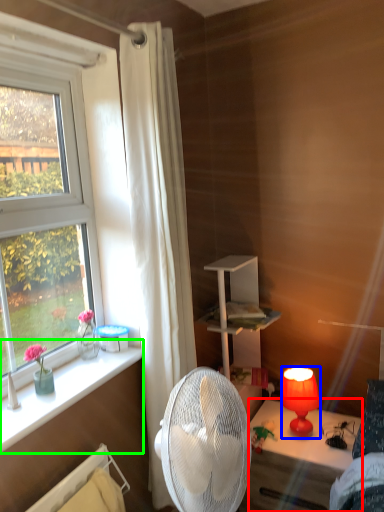
Question: Which object is positioned farthest from desk (highlighted by a red box)? Select from lamp (highlighted by a blue box) and window sill (highlighted by a green box).

Choices:
 (A) lamp
 (B) window sill

Answer: (B)